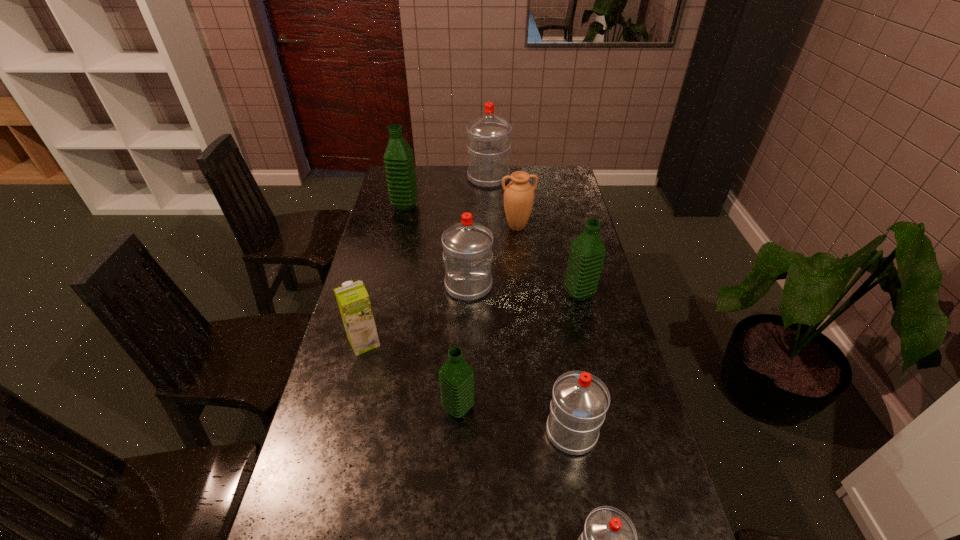
Find the location of a particular element. This screenshot has height=540, width=960. the second smallest white water bottle is located at coordinates (580, 400).

Where is `the second green water bottle from right to left`? The width and height of the screenshot is (960, 540). the second green water bottle from right to left is located at coordinates click(x=456, y=377).

This screenshot has width=960, height=540. In order to click on the nearest green water bottle in this screenshot , I will do `click(456, 377)`.

At what (x,y) coordinates should I click in order to perform the action: click on free space located 0.250m on the front of the farthest green water bottle. Please return your answer as a coordinate pair (x, y). Looking at the image, I should click on (396, 249).

At what (x,y) coordinates should I click in order to perform the action: click on blank space located 0.150m on the handle side of the third smallest white water bottle. Please return your answer as a coordinate pair (x, y). The height and width of the screenshot is (540, 960). Looking at the image, I should click on (468, 336).

This screenshot has width=960, height=540. Identify the location of free space located 0.200m on the left of the second farthest green water bottle. (506, 294).

Find the location of `blank space located 0.320m on the right of the sixth farthest object`. blank space located 0.320m on the right of the sixth farthest object is located at coordinates (484, 342).

Find the location of a particular element. free region located 0.360m on the left of the urn is located at coordinates (413, 227).

Locate an element on the screen. This screenshot has height=540, width=960. vacant position located 0.090m on the handle side of the third biggest white water bottle is located at coordinates (564, 381).

Where is `free space located 0.250m on the handle side of the third biggest white water bottle`? This screenshot has height=540, width=960. free space located 0.250m on the handle side of the third biggest white water bottle is located at coordinates (556, 338).